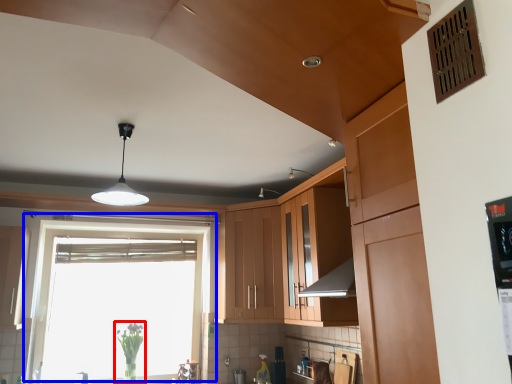
Question: Which of the following is the closest to the observer, plant (highlighted by a red box) or window (highlighted by a blue box)?

Choices:
 (A) plant
 (B) window

Answer: (B)